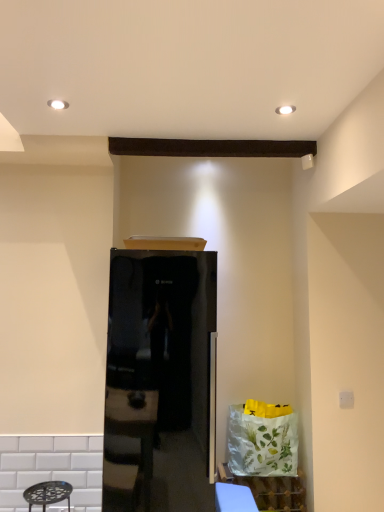
Image resolution: width=384 pixels, height=512 pixels. What do you see at coordinates (270, 490) in the screenshot?
I see `white glossy cabinet at lower right` at bounding box center [270, 490].

Describe the element at coordinates (234, 498) in the screenshot. I see `blue fabric table at lower center` at that location.

Identify the location of blue fabric table at lower center. This screenshot has height=512, width=384. (234, 498).

Where is `glossy black refrigerator at center`? glossy black refrigerator at center is located at coordinates (163, 373).

Where is `white glossy cabinet at lower right`? white glossy cabinet at lower right is located at coordinates (270, 490).

Is white glossy cabinet at lower right not within glossy black refrigerator at center?

Indeed, white glossy cabinet at lower right is completely outside glossy black refrigerator at center.

From a real-world perspective, is white glossy cabinet at lower right physically above glossy black refrigerator at center?

Actually, white glossy cabinet at lower right is physically below glossy black refrigerator at center in the real world.

Can you see white glossy cabinet at lower right touching glossy black refrigerator at center?

white glossy cabinet at lower right and glossy black refrigerator at center are not in contact.

In the scene shown: From their relative heights in the image, would you say white glossy cabinet at lower right is taller or shorter than glossy black refrigerator at center?

Clearly, white glossy cabinet at lower right is shorter compared to glossy black refrigerator at center.

How different are the orientations of glossy black refrigerator at center and blue fabric table at lower center in degrees?

The angle between the facing direction of glossy black refrigerator at center and the facing direction of blue fabric table at lower center is 0.000963 degrees.

Based on the photo, which is further, (107,403) or (229,507)?

The point (107,403) is farther from the camera.

From the image's perspective, is glossy black refrigerator at center above blue fabric table at lower center?

Yes, from the image's perspective, glossy black refrigerator at center is over blue fabric table at lower center.

Is glossy black refrigerator at center positioned far away from blue fabric table at lower center?

No.

How far apart are blue fabric table at lower center and white glossy cabinet at lower right?

They are 13.71 inches apart.

Is blue fabric table at lower center positioned in front of white glossy cabinet at lower right?

That is True.

Could you tell me if blue fabric table at lower center is turned towards white glossy cabinet at lower right?

No.

Do you think blue fabric table at lower center is within white glossy cabinet at lower right, or outside of it?

blue fabric table at lower center is outside white glossy cabinet at lower right.

Does blue fabric table at lower center have a larger size compared to glossy black refrigerator at center?

No.

Which object is more forward, blue fabric table at lower center or glossy black refrigerator at center?

Positioned in front is glossy black refrigerator at center.

Is blue fabric table at lower center looking in the opposite direction of glossy black refrigerator at center?

No, glossy black refrigerator at center is not at the back of blue fabric table at lower center.

From the image's perspective, is glossy black refrigerator at center above white glossy cabinet at lower right?

Indeed, from the image's perspective, glossy black refrigerator at center is shown above white glossy cabinet at lower right.

Is glossy black refrigerator at center aimed at white glossy cabinet at lower right?

No.

From the picture: Could white glossy cabinet at lower right be considered to be inside glossy black refrigerator at center?

No, white glossy cabinet at lower right is located outside of glossy black refrigerator at center.

Which is more distant, (128, 298) or (267, 490)?

The point (267, 490) is farther from the camera.

Considering the positions of objects white glossy cabinet at lower right and blue fabric table at lower center in the image provided, who is more to the right, white glossy cabinet at lower right or blue fabric table at lower center?

From the viewer's perspective, white glossy cabinet at lower right appears more on the right side.

Is white glossy cabinet at lower right oriented towards blue fabric table at lower center?

Yes, white glossy cabinet at lower right is oriented towards blue fabric table at lower center.

Which point is more distant from viewer, [222,472] or [236,492]?

The point [222,472] is behind.

What's the angular difference between white glossy cabinet at lower right and blue fabric table at lower center's facing directions?

They differ by 0.000519 degrees in their facing directions.

I want to click on cabinetry lying on the right of glossy black refrigerator at center, so click(x=270, y=490).

In order to click on table located behind the glossy black refrigerator at center in this screenshot , I will do `click(234, 498)`.

Considering their positions, is glossy black refrigerator at center positioned closer to blue fabric table at lower center than white glossy cabinet at lower right?

white glossy cabinet at lower right is positioned closer to the anchor blue fabric table at lower center.

From the image, which object appears to be farther from blue fabric table at lower center, white glossy cabinet at lower right or glossy black refrigerator at center?

glossy black refrigerator at center is further to blue fabric table at lower center.

Based on their spatial positions, is blue fabric table at lower center or white glossy cabinet at lower right closer to glossy black refrigerator at center?

Among the two, blue fabric table at lower center is located nearer to glossy black refrigerator at center.

When comparing their distances from white glossy cabinet at lower right, does glossy black refrigerator at center or blue fabric table at lower center seem closer?

Based on the image, blue fabric table at lower center appears to be nearer to white glossy cabinet at lower right.

When comparing their distances from glossy black refrigerator at center, does white glossy cabinet at lower right or blue fabric table at lower center seem further?

white glossy cabinet at lower right lies further to glossy black refrigerator at center than the other object.

Estimate the real-world distances between objects in this image. Which object is further from white glossy cabinet at lower right, blue fabric table at lower center or glossy black refrigerator at center?

glossy black refrigerator at center lies further to white glossy cabinet at lower right than the other object.

Identify the location of table between glossy black refrigerator at center and white glossy cabinet at lower right vertically. This screenshot has height=512, width=384. (234, 498).